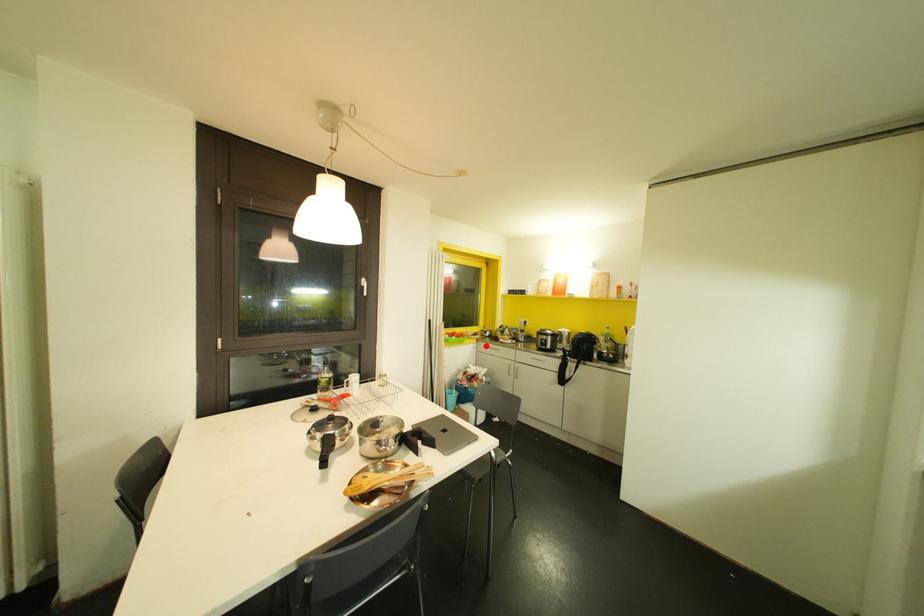
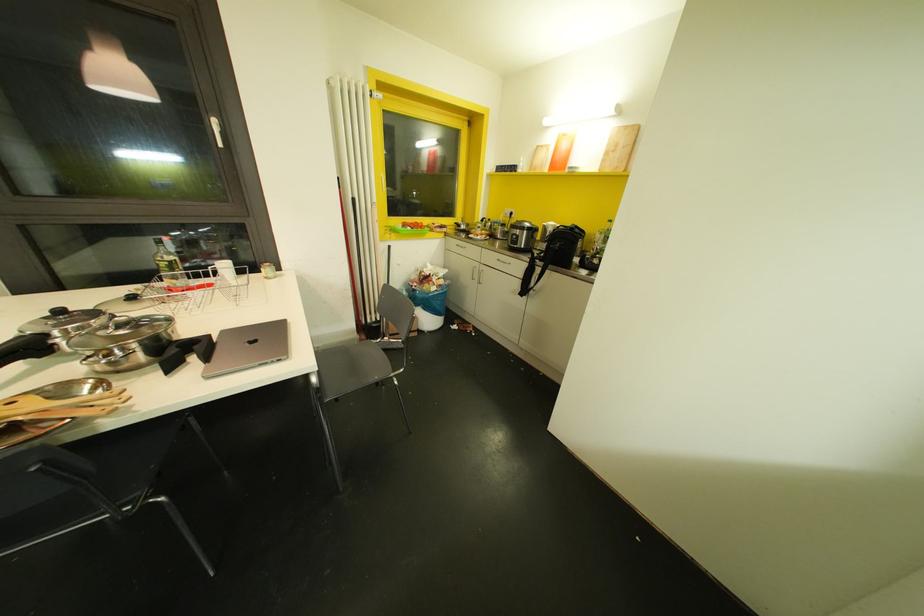
In the second image, find the point that corresponds to the highlighted location in the first image.

(453, 243)